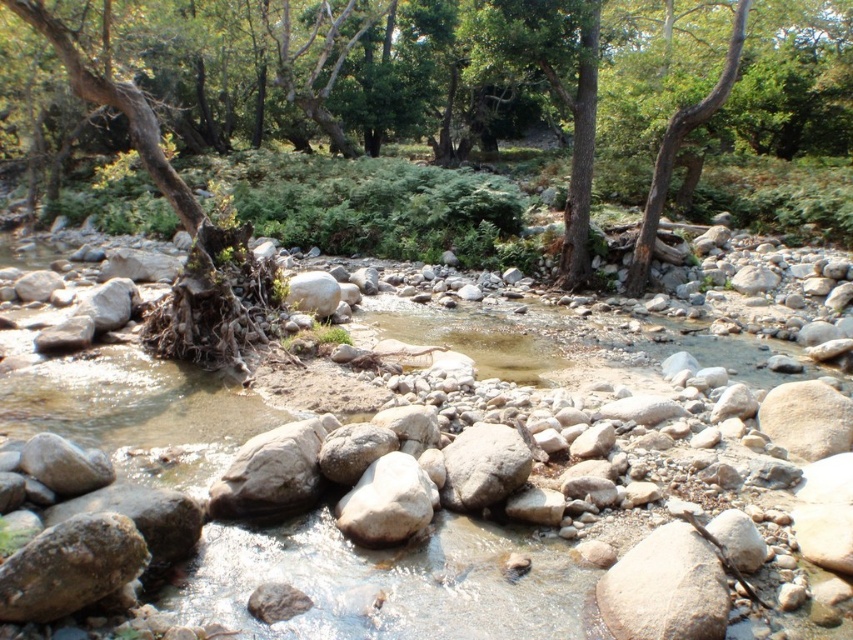
Does clear water at center have a lesser width compared to smooth gray rock at center?

No.

Is point (219, 596) closer to camera compared to point (392, 490)?

Yes, it is.

Which is behind, point (416, 596) or point (354, 528)?

The point (354, 528) is behind.

Where is `clear water at center`? clear water at center is located at coordinates (392, 582).

Does brown rough tree at center have a greater width compared to clear water at center?

Yes, brown rough tree at center is wider than clear water at center.

Which of these two, brown rough tree at center or clear water at center, stands shorter?

clear water at center is shorter.

Which is in front, point (308, 184) or point (494, 410)?

Point (494, 410) is in front.

This screenshot has width=853, height=640. I want to click on brown rough tree at center, so click(547, 83).

Between point (514, 372) and point (276, 323), which one is positioned behind?

The point (276, 323) is behind.

Who is higher up, clear water at center or brown rough tree trunk at left?

brown rough tree trunk at left

Who is more forward, (517, 579) or (149, 161)?

Point (517, 579) is in front.

Image resolution: width=853 pixels, height=640 pixels. I want to click on clear water at center, so click(392, 582).